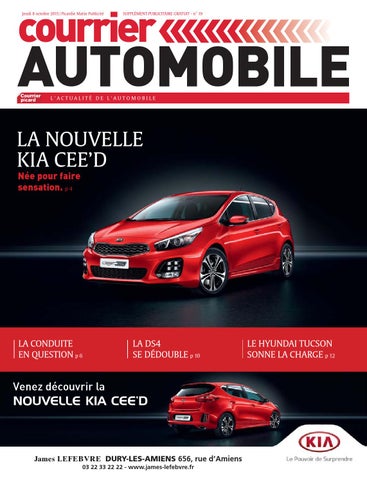
You are a GUI agent. You are given a task and a screenshot of the screen. Output one action in this format:
    pyautogui.click(x=<x>, y=<y>)
    Task: Click on the door handle
    
    Given the screenshot: What is the action you would take?
    pyautogui.click(x=256, y=232), pyautogui.click(x=254, y=405)